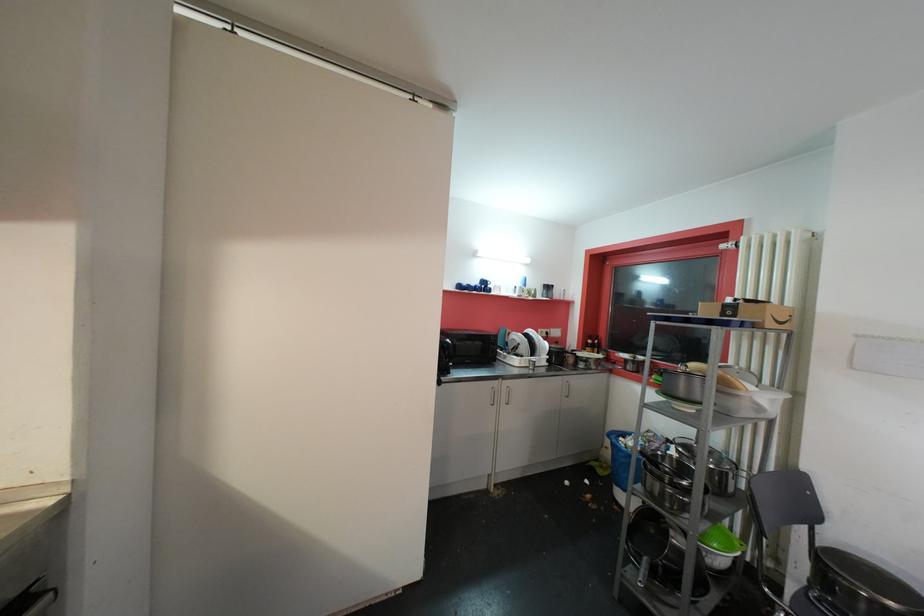
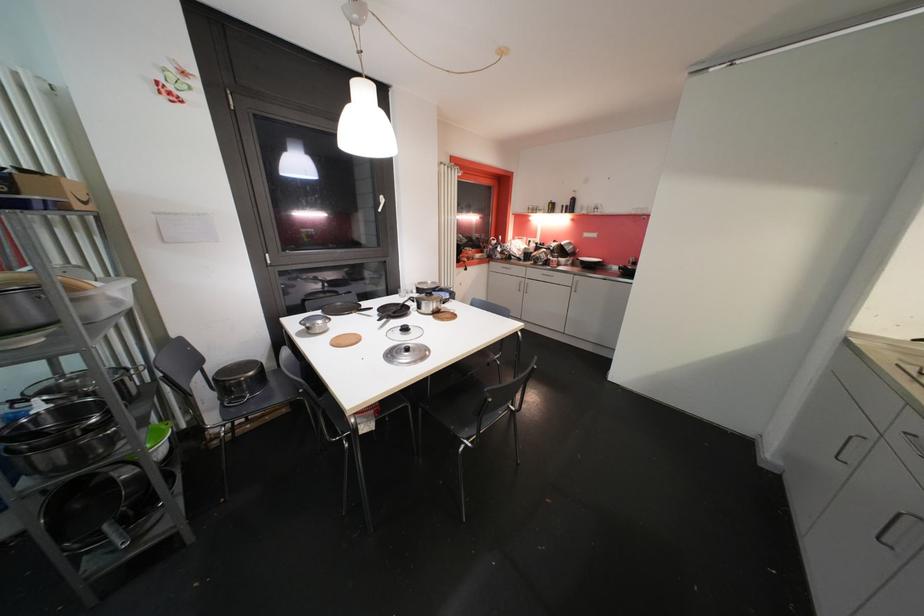
In the second image, find the point that corresponds to pixel 764 411 in the first image.

(122, 305)